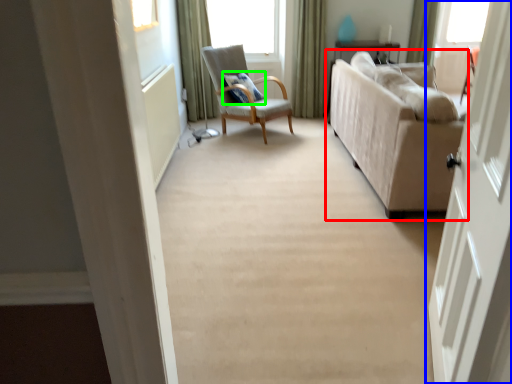
Question: Estimate the real-world distances between objects in this image. Which object is farther from studio couch (highlighted by a red box), door (highlighted by a blue box) or pillow (highlighted by a green box)?

Choices:
 (A) door
 (B) pillow

Answer: (B)